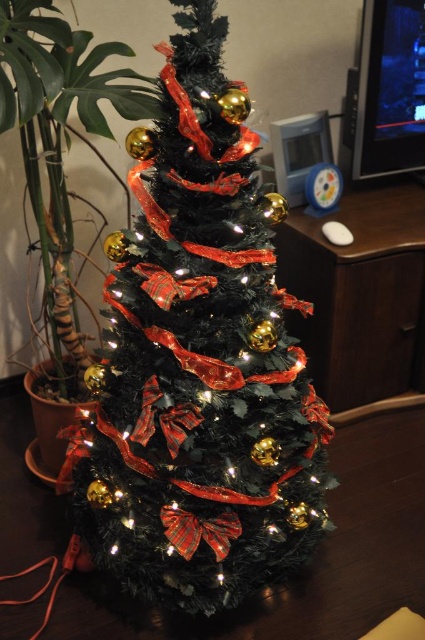
Which is in front, point (195, 52) or point (367, 324)?

Point (195, 52) is more forward.

Is point (155, 568) closer to viewer compared to point (314, 252)?

Yes, it is.

Does point (201, 81) come closer to viewer compared to point (362, 211)?

Yes, it is.

Identify the location of shiny green christmas tree at center. The width and height of the screenshot is (425, 640). (198, 362).